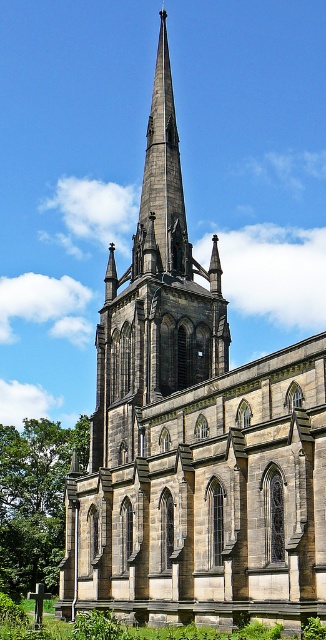
Is green leafy tree at left smaller than dark gray stone spire at center?

No, green leafy tree at left is not smaller than dark gray stone spire at center.

Is point (48, 589) closer to viewer compared to point (171, 269)?

No, (48, 589) is further to viewer.

Find the location of `green leafy tree at left`. green leafy tree at left is located at coordinates (34, 499).